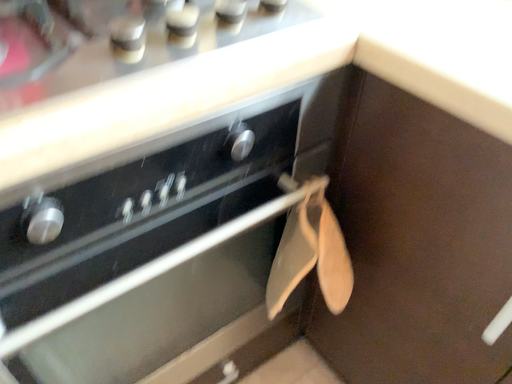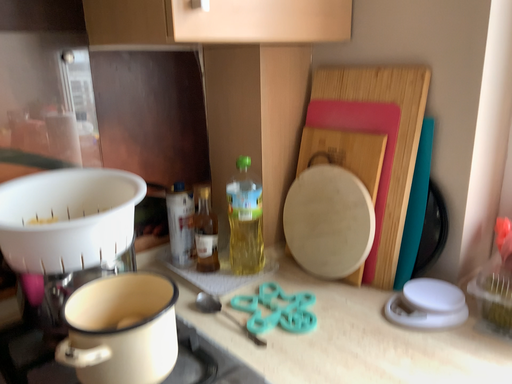
Question: How did the camera likely rotate when shooting the video?

Choices:
 (A) rotated downward
 (B) rotated upward

Answer: (B)